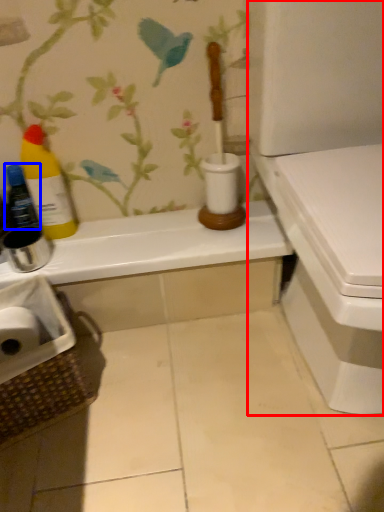
Question: Which object is closer to the camera taking this photo, toilet (highlighted by a red box) or bottle (highlighted by a blue box)?

Choices:
 (A) toilet
 (B) bottle

Answer: (A)